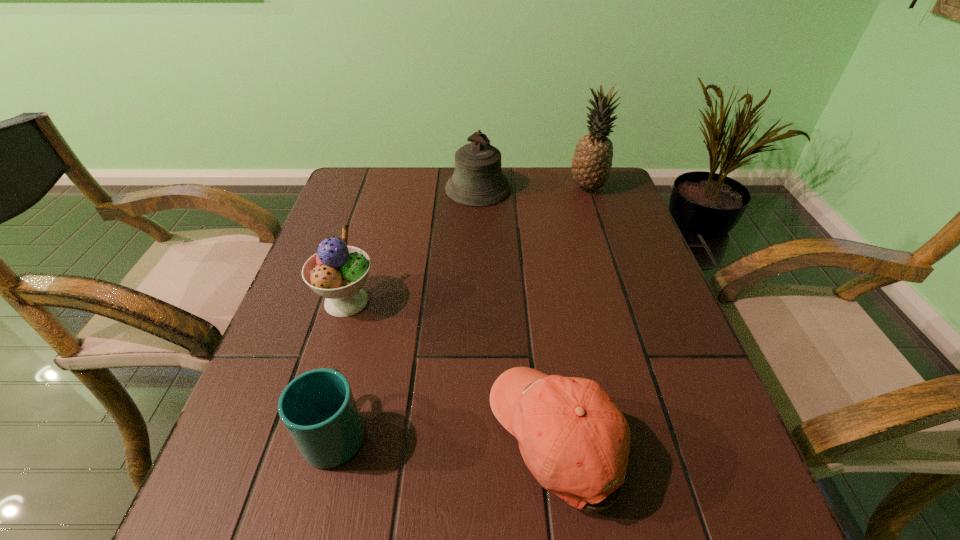
Find the location of a particular element. vacant region between the icecream and the rightmost object is located at coordinates (467, 245).

Locate an element on the screen. vacant area between the tallest object and the third farthest object is located at coordinates (467, 245).

What are the coordinates of `free space that is in between the baseball cap and the tallest object` in the screenshot? It's located at (573, 312).

Locate an element on the screen. The width and height of the screenshot is (960, 540). vacant point located between the icecream and the baseball cap is located at coordinates (453, 369).

Locate an element on the screen. vacant space that's between the baseball cap and the bell is located at coordinates (518, 313).

In order to click on free space between the baseball cap and the cup in this screenshot , I will do `click(447, 434)`.

Find the location of a particular element. The image size is (960, 540). vacant space in between the icecream and the cup is located at coordinates (341, 366).

Identify the location of object that is the third closest to the bell. This screenshot has height=540, width=960. (559, 422).

Identify the location of object that is the closest one to the baseball cap. This screenshot has height=540, width=960. (318, 409).